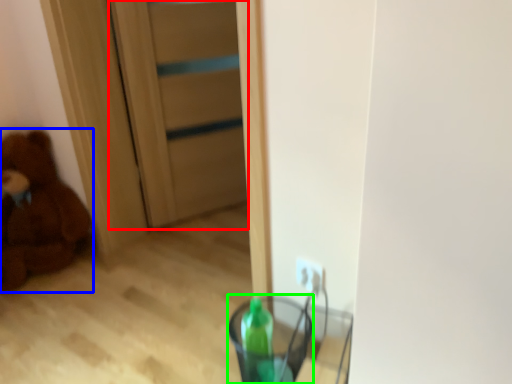
Question: Considering the real-world distances, which object is farthest from door (highlighted by a red box)? teddy bear (highlighted by a blue box) or glass vase (highlighted by a green box)?

Choices:
 (A) teddy bear
 (B) glass vase

Answer: (B)